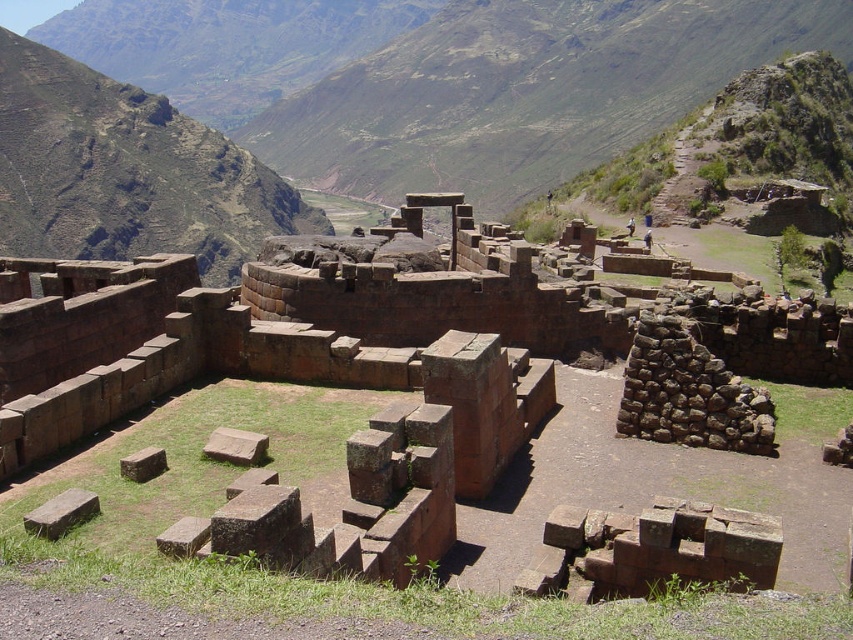
Which is behind, point (531, 273) or point (68, 58)?

Positioned behind is point (68, 58).

Consider the image. Does brown stone ruins at center have a smaller size compared to green rocky mountain at upper left?

Yes.

In order to click on brown stone ruins at center in this screenshot , I will do `click(395, 340)`.